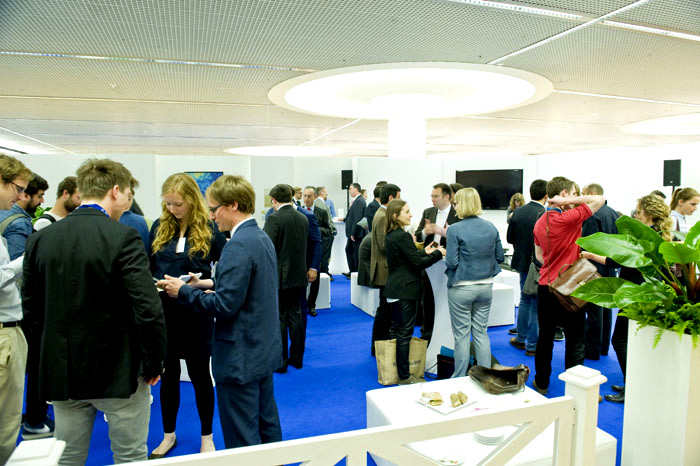
I want to click on plate, so click(x=444, y=404).